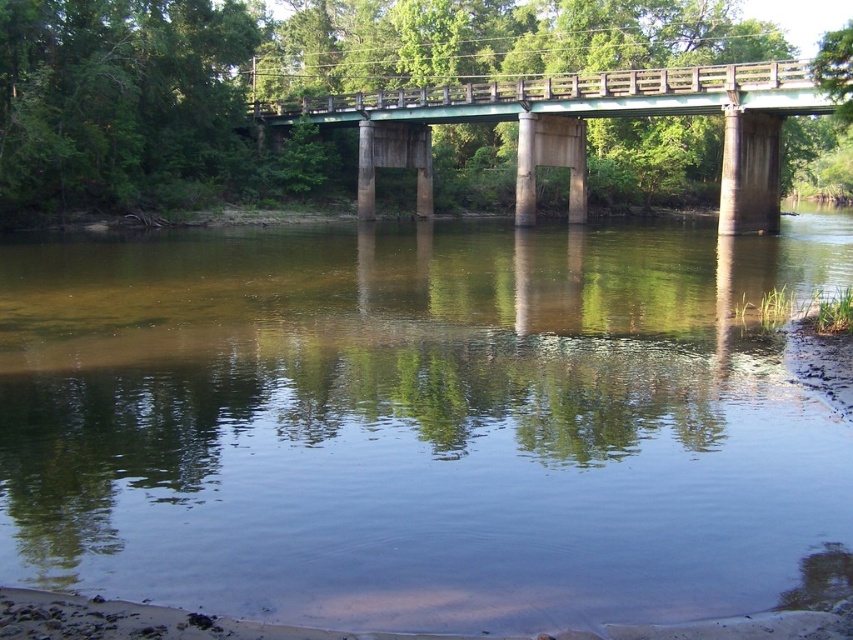
Question: Can you confirm if clear water at center is thinner than green concrete bridge at center?

Choices:
 (A) yes
 (B) no

Answer: (A)

Question: Which point is closer to the camera?

Choices:
 (A) green concrete bridge at center
 (B) clear water at center

Answer: (B)

Question: Is clear water at center bigger than green concrete bridge at center?

Choices:
 (A) no
 (B) yes

Answer: (A)

Question: Which object is farther from the camera taking this photo?

Choices:
 (A) clear water at center
 (B) green concrete bridge at center

Answer: (B)

Question: Which object appears closest to the camera in this image?

Choices:
 (A) clear water at center
 (B) green concrete bridge at center

Answer: (A)

Question: Is clear water at center smaller than green concrete bridge at center?

Choices:
 (A) no
 (B) yes

Answer: (B)